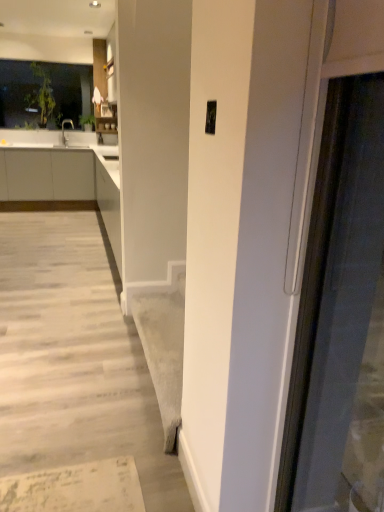
Question: Is transparent glass window at upper left wider than white matte cabinetry at left?

Choices:
 (A) no
 (B) yes

Answer: (A)

Question: Is transparent glass window at upper left shorter than white matte cabinetry at left?

Choices:
 (A) yes
 (B) no

Answer: (B)

Question: Is transparent glass window at upper left further to camera compared to white matte cabinetry at left?

Choices:
 (A) no
 (B) yes

Answer: (B)

Question: From the image's perspective, is transparent glass window at upper left below white matte cabinetry at left?

Choices:
 (A) no
 (B) yes

Answer: (A)

Question: Does transparent glass window at upper left come in front of white matte cabinetry at left?

Choices:
 (A) no
 (B) yes

Answer: (A)

Question: Is white matte cabinetry at left taller or shorter than matte silver faucet at upper left?

Choices:
 (A) short
 (B) tall

Answer: (B)

Question: Based on their positions, is white matte cabinetry at left located to the left or right of matte silver faucet at upper left?

Choices:
 (A) left
 (B) right

Answer: (A)

Question: Considering the positions of white matte cabinetry at left and matte silver faucet at upper left in the image, is white matte cabinetry at left bigger or smaller than matte silver faucet at upper left?

Choices:
 (A) small
 (B) big

Answer: (B)

Question: Is white matte cabinetry at left inside or outside of matte silver faucet at upper left?

Choices:
 (A) outside
 (B) inside

Answer: (A)

Question: Is matte silver faucet at upper left in front of or behind transparent glass window at upper left in the image?

Choices:
 (A) front
 (B) behind

Answer: (B)

Question: Looking at the image, does matte silver faucet at upper left seem bigger or smaller compared to transparent glass window at upper left?

Choices:
 (A) big
 (B) small

Answer: (B)

Question: From the image's perspective, is matte silver faucet at upper left located above or below transparent glass window at upper left?

Choices:
 (A) above
 (B) below

Answer: (B)

Question: Based on their positions, is matte silver faucet at upper left located to the left or right of transparent glass window at upper left?

Choices:
 (A) left
 (B) right

Answer: (B)

Question: Based on their positions, is transparent glass window at upper left located to the left or right of matte silver faucet at upper left?

Choices:
 (A) right
 (B) left

Answer: (B)

Question: From the image's perspective, relative to matte silver faucet at upper left, is transparent glass window at upper left above or below?

Choices:
 (A) above
 (B) below

Answer: (A)